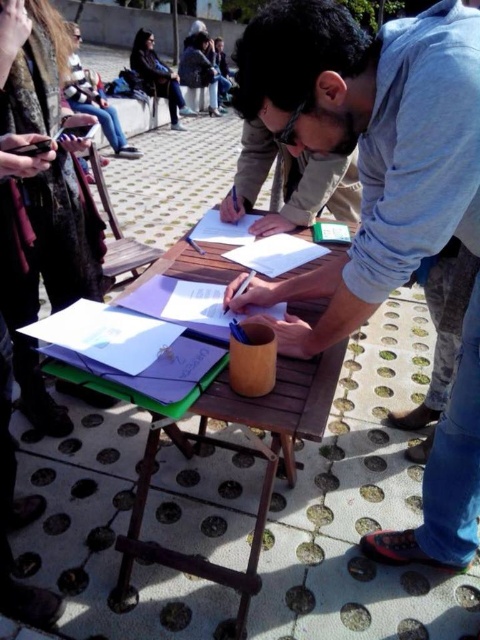
Question: Is wooden picnic table at center bigger than matte black jacket at upper left?

Choices:
 (A) yes
 (B) no

Answer: (B)

Question: Does matte blue shirt at center appear on the right side of wooden picnic table at center?

Choices:
 (A) no
 (B) yes

Answer: (B)

Question: Which of these objects is positioned closest to the wooden picnic table at center?

Choices:
 (A) matte black jacket at upper left
 (B) matte blue shirt at center

Answer: (B)

Question: Is wooden picnic table at center above matte black jacket at upper left?

Choices:
 (A) yes
 (B) no

Answer: (B)

Question: Estimate the real-world distances between objects in this image. Which object is closer to the matte black jacket at upper left?

Choices:
 (A) wooden picnic table at center
 (B) matte blue shirt at center

Answer: (A)

Question: Among these points, which one is farthest from the camera?

Choices:
 (A) (421, 109)
 (B) (300, 392)
 (C) (177, 120)

Answer: (C)